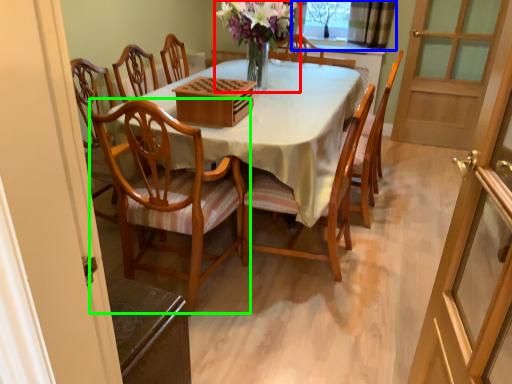
Question: Which object is the farthest from floral arrangement (highlighted by a red box)? Choose among these: window (highlighted by a blue box) or chair (highlighted by a green box).

Choices:
 (A) window
 (B) chair

Answer: (A)